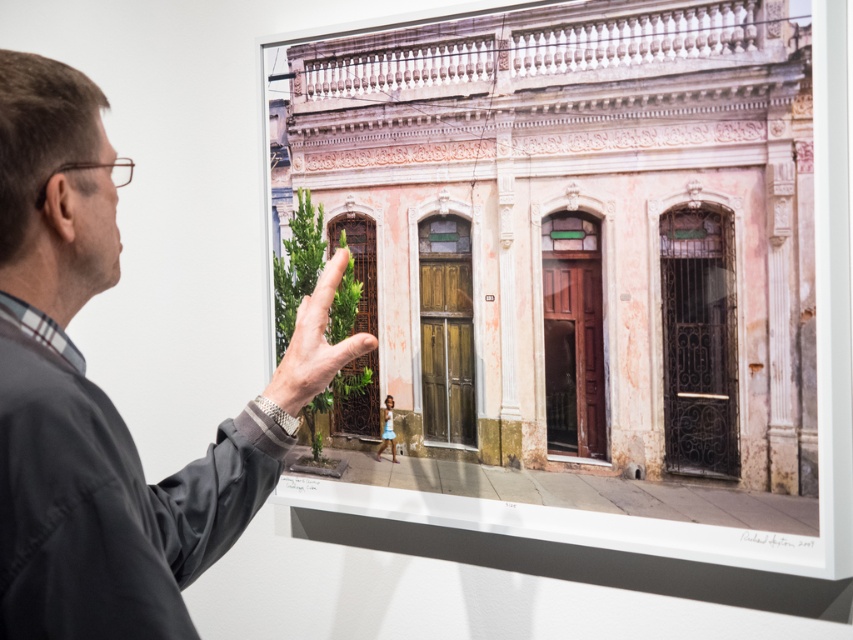
You are standing in an art gallery and see the matte pink building at center and the gray fabric shirt at upper left. Which object is closer to you?

The matte pink building at center is closer to you because the gray fabric shirt at upper left is behind it.

You are an art curator standing in front of the framed photograph in the art gallery. You notice two points marked on the photograph at coordinates point (x=779, y=200) and point (x=16, y=170). Which of these points appears closer to your eyes when viewing the photograph?

Point (x=779, y=200) is further to the viewer than point (x=16, y=170), so the point (x=779, y=200) appears closer to your eyes when viewing the photograph.